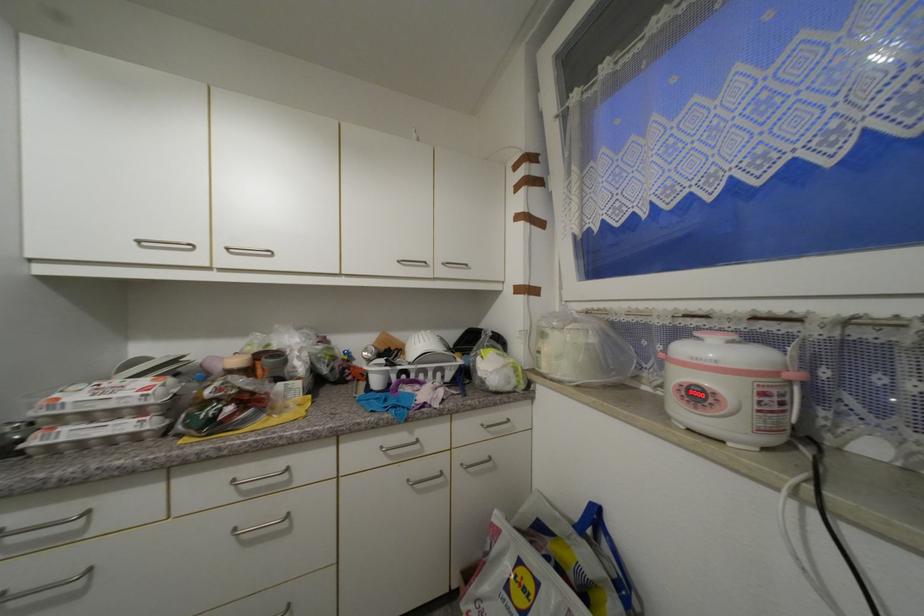
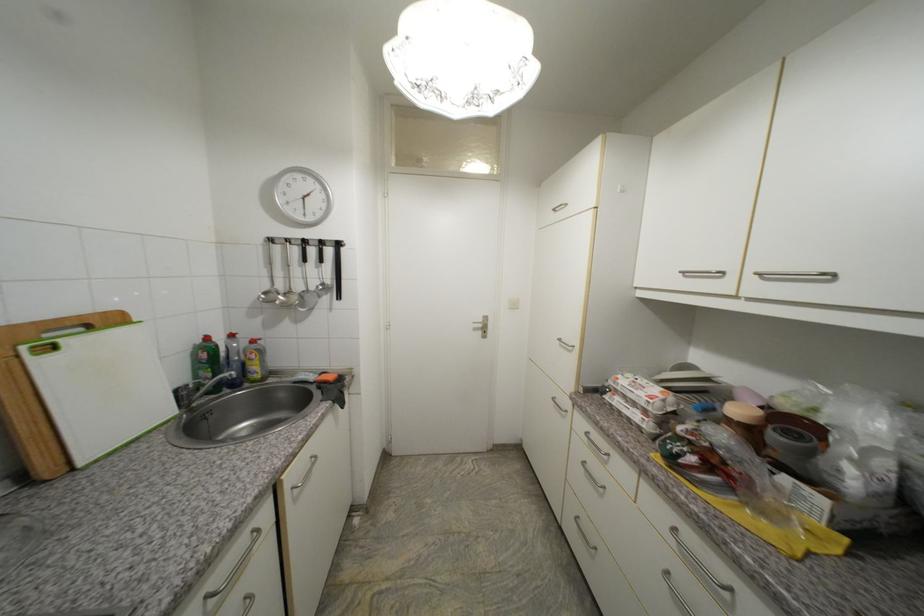
The point at (67, 440) is marked in the first image. Where is the corresponding point in the second image?

(619, 405)